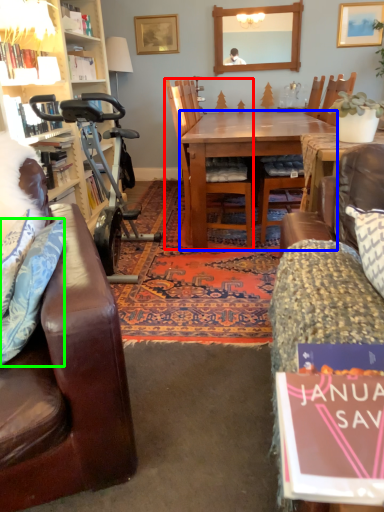
Question: Which is farther away from chair (highlighted by a red box)? desk (highlighted by a blue box) or pillow (highlighted by a green box)?

Choices:
 (A) desk
 (B) pillow

Answer: (B)